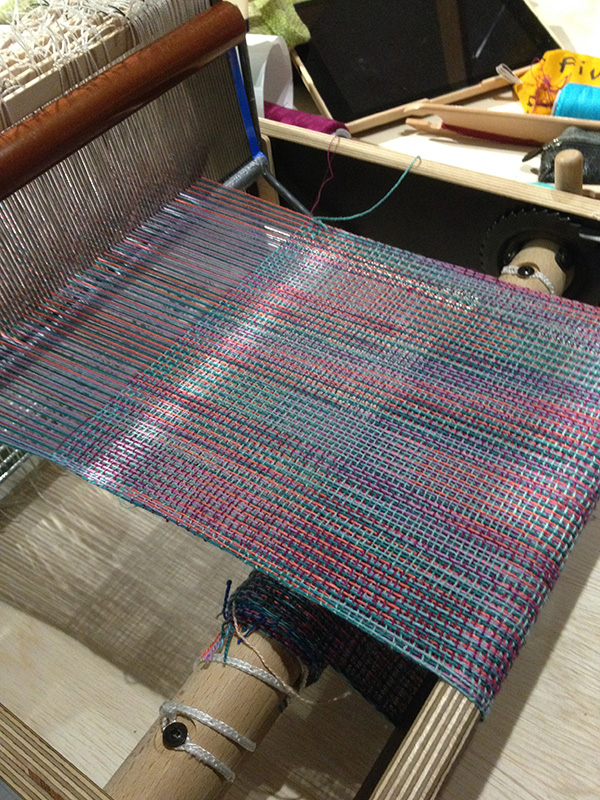
Locate an element on the screen. This screenshot has width=600, height=800. wooden rod is located at coordinates (244, 700), (547, 269).